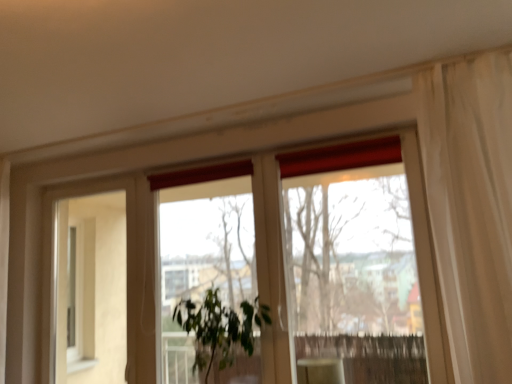
Question: Is transparent glass window at center taller than green leafy plant at center?

Choices:
 (A) yes
 (B) no

Answer: (A)

Question: Does transparent glass window at center have a larger size compared to green leafy plant at center?

Choices:
 (A) no
 (B) yes

Answer: (B)

Question: Is transparent glass window at center not close to green leafy plant at center?

Choices:
 (A) yes
 (B) no

Answer: (B)

Question: Is transparent glass window at center placed right next to green leafy plant at center?

Choices:
 (A) no
 (B) yes

Answer: (A)

Question: Considering the relative sizes of transparent glass window at center and green leafy plant at center in the image provided, is transparent glass window at center thinner than green leafy plant at center?

Choices:
 (A) yes
 (B) no

Answer: (A)

Question: Considering their positions, is green leafy plant at center located in front of or behind matte white cabinet at lower center?

Choices:
 (A) front
 (B) behind

Answer: (A)

Question: From the image's perspective, is green leafy plant at center positioned above or below matte white cabinet at lower center?

Choices:
 (A) above
 (B) below

Answer: (A)

Question: Is green leafy plant at center situated inside matte white cabinet at lower center or outside?

Choices:
 (A) inside
 (B) outside

Answer: (B)

Question: Considering the positions of green leafy plant at center and matte white cabinet at lower center in the image, is green leafy plant at center taller or shorter than matte white cabinet at lower center?

Choices:
 (A) tall
 (B) short

Answer: (A)

Question: Is beige matte screen door at left inside or outside of matte white cabinet at lower center?

Choices:
 (A) inside
 (B) outside

Answer: (B)

Question: From the image's perspective, relative to matte white cabinet at lower center, is beige matte screen door at left above or below?

Choices:
 (A) below
 (B) above

Answer: (B)

Question: Looking at their shapes, would you say beige matte screen door at left is wider or thinner than matte white cabinet at lower center?

Choices:
 (A) wide
 (B) thin

Answer: (B)

Question: Based on their positions, is beige matte screen door at left located to the left or right of matte white cabinet at lower center?

Choices:
 (A) left
 (B) right

Answer: (A)

Question: Is matte white cabinet at lower center bigger or smaller than transparent glass window at center?

Choices:
 (A) small
 (B) big

Answer: (A)

Question: From the image's perspective, relative to transparent glass window at center, is matte white cabinet at lower center above or below?

Choices:
 (A) below
 (B) above

Answer: (A)